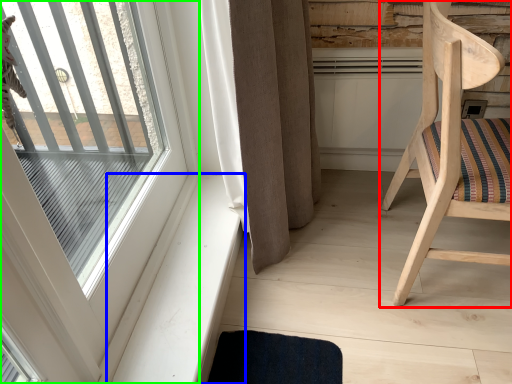
Question: Which object is the farthest from chair (highlighted by a red box)? Choose among these: window sill (highlighted by a blue box) or window (highlighted by a green box).

Choices:
 (A) window sill
 (B) window

Answer: (B)